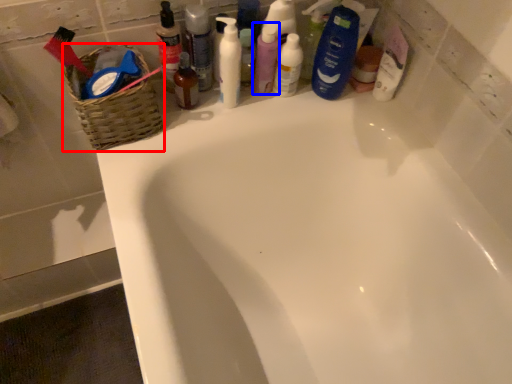
Question: Which of the following is the closest to the observer, basket (highlighted by a red box) or toiletry (highlighted by a blue box)?

Choices:
 (A) basket
 (B) toiletry

Answer: (A)